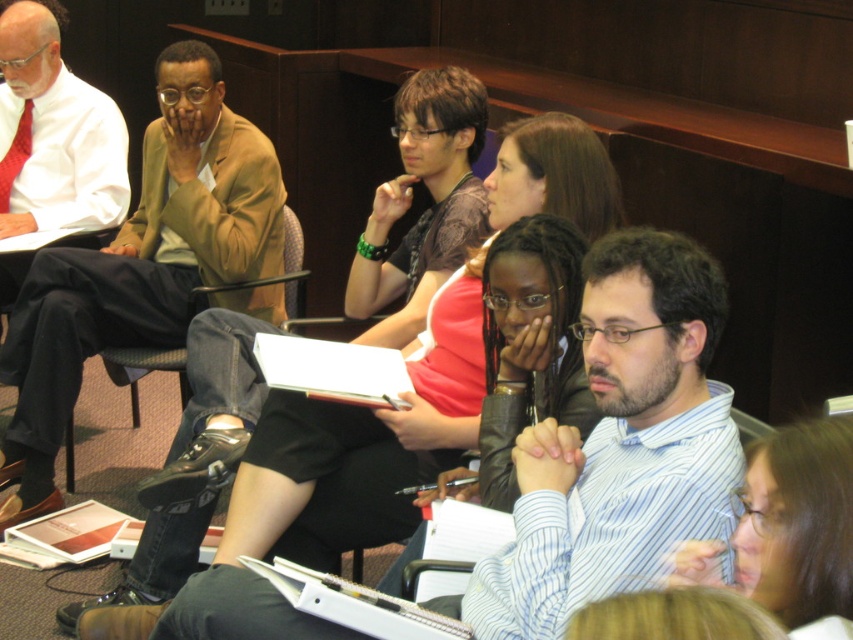
Is blue striped shirt at center further to camera compared to light brown leather jacket at upper left?

That is False.

Find the location of a particular element. blue striped shirt at center is located at coordinates click(619, 444).

What are the coordinates of `blue striped shirt at center` in the screenshot? It's located at click(x=619, y=444).

Is blue striped shirt at center to the left of black leather chair at center from the viewer's perspective?

In fact, blue striped shirt at center is to the right of black leather chair at center.

Does blue striped shirt at center lie behind black leather chair at center?

That is False.

This screenshot has height=640, width=853. What are the coordinates of `blue striped shirt at center` in the screenshot? It's located at (619, 444).

Is striped cotton shirt at center closer to the viewer compared to black leather chair at center?

Yes, striped cotton shirt at center is closer to the viewer.

Can you confirm if striped cotton shirt at center is wider than black leather chair at center?

Yes, striped cotton shirt at center is wider than black leather chair at center.

Is point (642, 586) positioned behind point (178, 368)?

No, it is in front of (178, 368).

The width and height of the screenshot is (853, 640). In order to click on striped cotton shirt at center in this screenshot , I will do `click(619, 444)`.